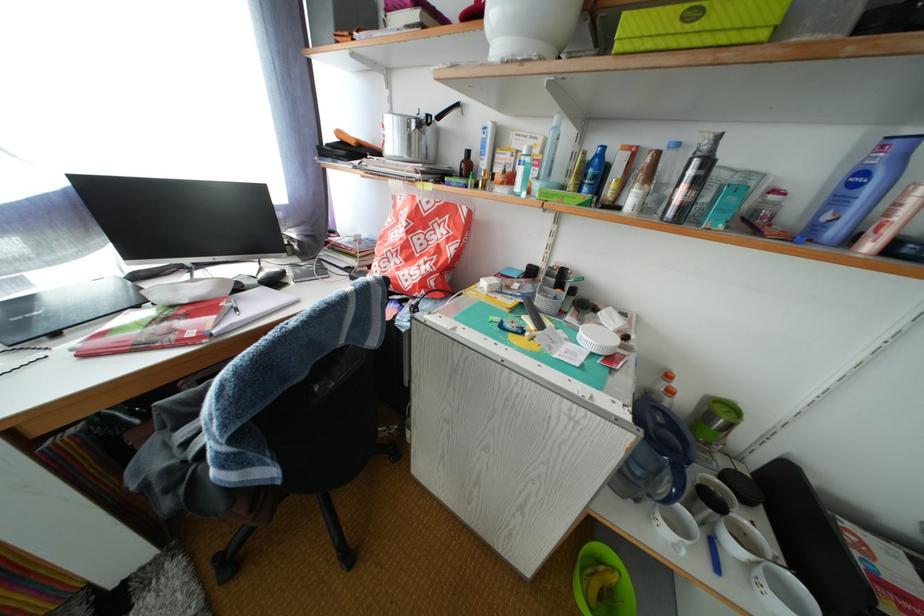
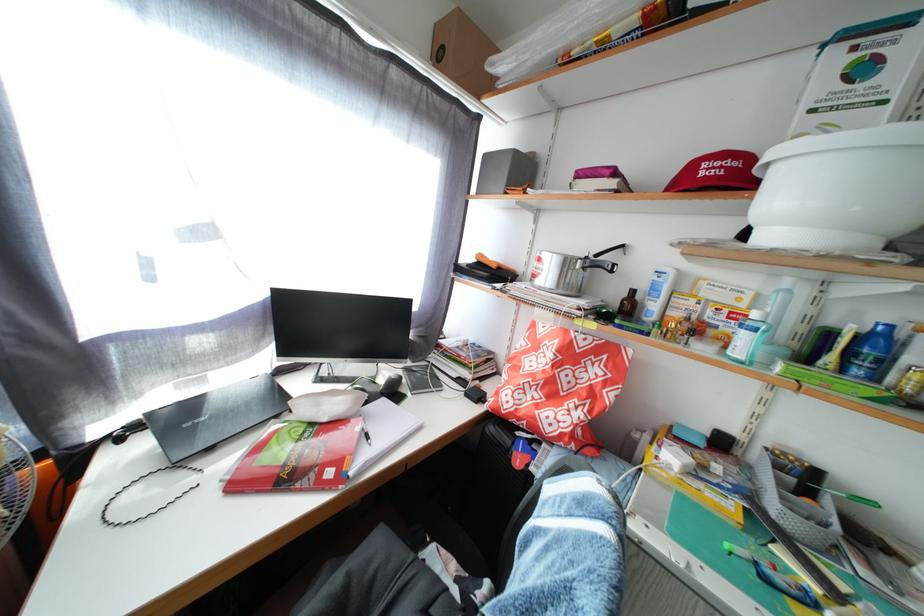
Find the pixel in the second image that matches (347,139) in the first image.

(489, 262)